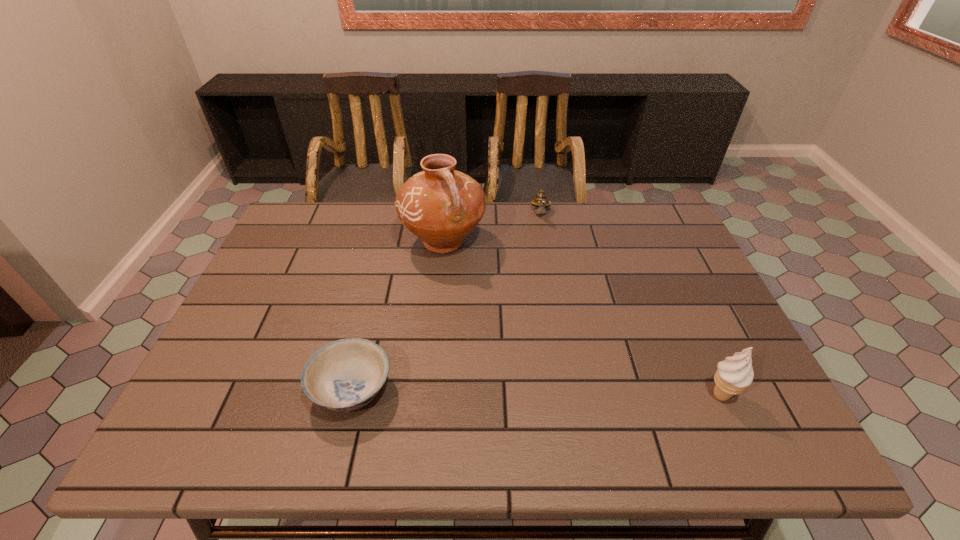
This screenshot has width=960, height=540. Identify the location of bowl. (344, 375).

This screenshot has height=540, width=960. In order to click on the rightmost object in this screenshot , I will do `click(734, 374)`.

This screenshot has width=960, height=540. Identify the location of icecream. (734, 374).

The image size is (960, 540). In order to click on pottery in this screenshot , I will do `click(441, 206)`.

Locate an element on the screen. The height and width of the screenshot is (540, 960). the second object from right to left is located at coordinates (541, 202).

The height and width of the screenshot is (540, 960). Find the location of `snail`. snail is located at coordinates (541, 202).

The height and width of the screenshot is (540, 960). In order to click on free region located 0.070m on the back of the shortest object in this screenshot , I will do `click(366, 334)`.

Image resolution: width=960 pixels, height=540 pixels. Identify the location of free location located 0.270m on the side of the tallest object with the handle. (489, 338).

Locate an element on the screen. free point located 0.300m on the side of the tallest object with the handle is located at coordinates (493, 347).

Locate an element on the screen. vacant point located on the side of the tallest object with the handle is located at coordinates (482, 323).